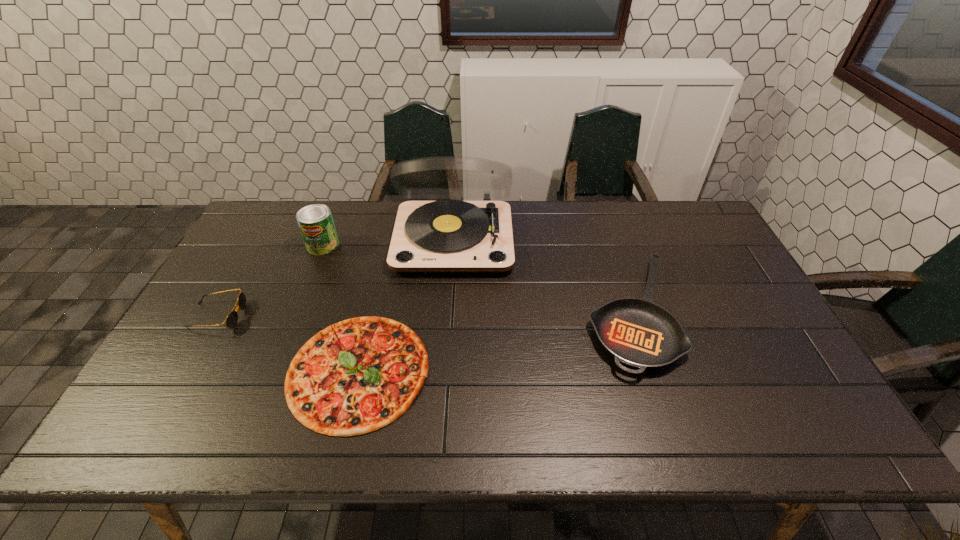
Locate an element on the screen. vacant area situated on the front of the frying pan is located at coordinates (675, 445).

The width and height of the screenshot is (960, 540). What are the coordinates of `vacant space located on the back of the shortest object` in the screenshot? It's located at pos(383,266).

I want to click on record player that is positioned at the far edge, so click(x=449, y=236).

Where is `can that is at the far edge`? The width and height of the screenshot is (960, 540). can that is at the far edge is located at coordinates (316, 224).

Find the location of a particular element. This screenshot has width=960, height=540. object that is positioned at the near edge is located at coordinates (356, 376).

Identify the location of object situated at the left edge. (232, 318).

The height and width of the screenshot is (540, 960). In the image, there is a desktop. In order to click on blank space at the far edge in this screenshot , I will do `click(601, 240)`.

The height and width of the screenshot is (540, 960). What are the coordinates of `free spot at the near edge of the desktop` in the screenshot? It's located at (716, 410).

This screenshot has width=960, height=540. In the image, there is a desktop. Identify the location of vacant space at the left edge. (264, 259).

Find the location of a particular element. vacant space at the right edge is located at coordinates (728, 327).